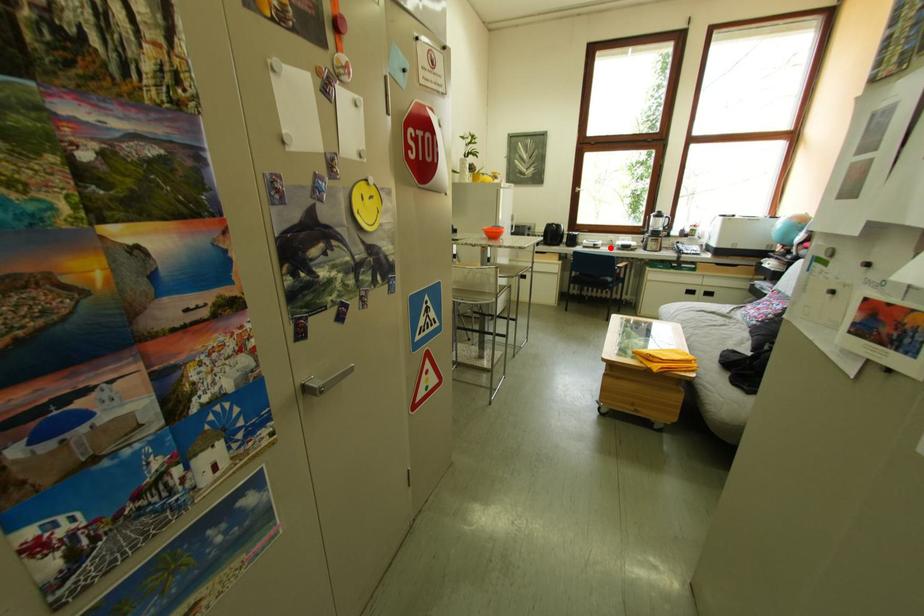
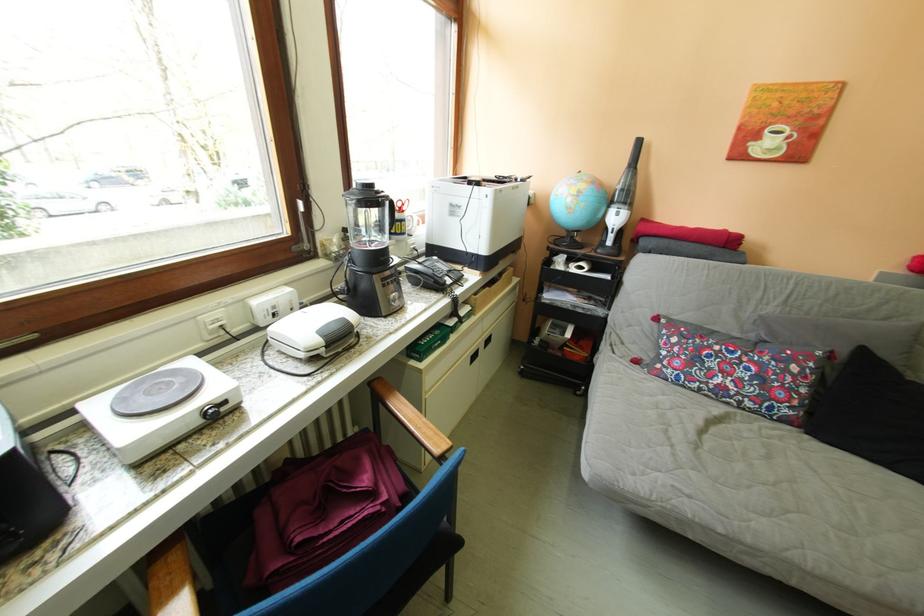
Locate, in the second image, the point that corresponds to the highlighted location in the first image.

(237, 406)